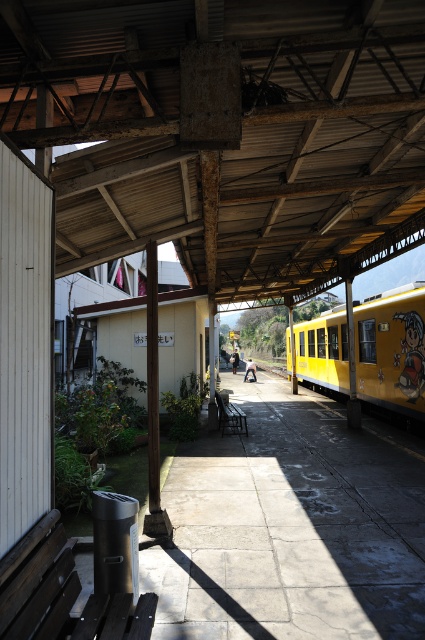
Does dark brown wooden bench at lower left have a larger size compared to wooden bench at center?

Actually, dark brown wooden bench at lower left might be smaller than wooden bench at center.

Which is below, dark brown wooden bench at lower left or wooden bench at center?

wooden bench at center

Which is behind, point (130, 614) or point (237, 428)?

Point (237, 428)

Locate an element on the screen. dark brown wooden bench at lower left is located at coordinates click(62, 593).

Measure the distance between yellow matte train at right and camera.

The distance of yellow matte train at right from camera is 34.28 feet.

Can you confirm if yellow matte train at right is shorter than dark brown wooden bench at lower left?

Incorrect, yellow matte train at right's height does not fall short of dark brown wooden bench at lower left's.

Measure the distance between point (393, 317) and camera.

Point (393, 317) and camera are 12.02 meters apart.

Where is `yellow matte train at right`? This screenshot has width=425, height=640. yellow matte train at right is located at coordinates (391, 349).

Which is in front, point (394, 392) or point (243, 419)?

Positioned in front is point (394, 392).

Locate an element on the screen. The height and width of the screenshot is (640, 425). yellow matte train at right is located at coordinates click(x=391, y=349).